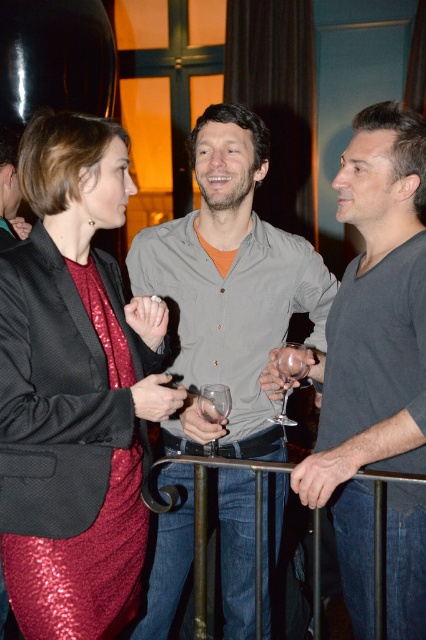
Question: Is gray matte shirt at center smaller than transparent glass wine glass at center?

Choices:
 (A) no
 (B) yes

Answer: (A)

Question: Is shiny sequined dress at left bigger than gray matte shirt at center?

Choices:
 (A) yes
 (B) no

Answer: (B)

Question: Which is nearer to the transparent glass at center?

Choices:
 (A) transparent glass wine glass at center
 (B) shiny sequined dress at left

Answer: (A)

Question: Which point appears farthest from the camera in this image?

Choices:
 (A) (109, 125)
 (B) (367, 365)

Answer: (B)

Question: Does gray cotton shirt at center appear on the right side of transparent glass at center?

Choices:
 (A) yes
 (B) no

Answer: (A)

Question: Which object is closer to the camera taking this photo?

Choices:
 (A) transparent glass at center
 (B) black metal railing at lower center

Answer: (B)